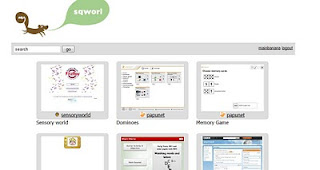
Locate an element on the screen. artwork is located at coordinates (38, 30).